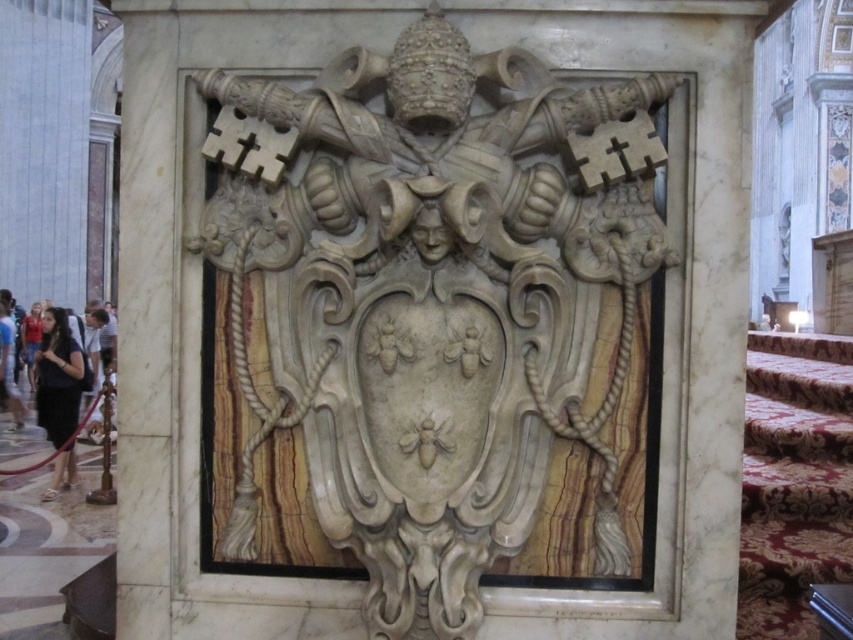
Question: Does white marble sculpture at center have a smaller size compared to dark brown hair at lower left?

Choices:
 (A) no
 (B) yes

Answer: (B)

Question: Is white marble sculpture at center wider than dark brown hair at left?

Choices:
 (A) no
 (B) yes

Answer: (B)

Question: Does white marble sculpture at center appear over dark brown hair at left?

Choices:
 (A) no
 (B) yes

Answer: (B)

Question: Among these objects, which one is farthest from the camera?

Choices:
 (A) dark brown hair at lower left
 (B) white marble sculpture at center
 (C) dark brown hair at left

Answer: (C)

Question: Which object is the closest to the white marble sculpture at center?

Choices:
 (A) dark brown hair at lower left
 (B) dark brown hair at left

Answer: (A)

Question: Which point is closer to the camera?

Choices:
 (A) (349, 465)
 (B) (44, 342)

Answer: (A)